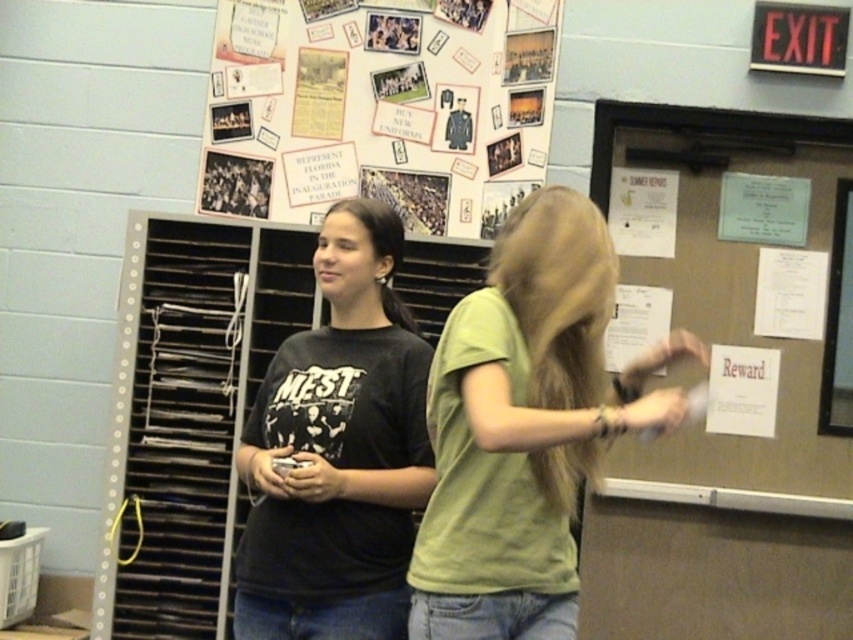
Question: Does multicolored collage at upper center appear on the left side of white paper reward at upper right?

Choices:
 (A) yes
 (B) no

Answer: (A)

Question: Does black matte t-shirt at center have a smaller size compared to white paper poster at upper right?

Choices:
 (A) no
 (B) yes

Answer: (A)

Question: Which point is closer to the camera taking this photo?

Choices:
 (A) (563, 557)
 (B) (421, 436)

Answer: (A)

Question: Which object appears farthest from the camera in this image?

Choices:
 (A) white paper reward at upper right
 (B) matte brown paperboard at right
 (C) multicolored collage at upper center

Answer: (A)

Question: Which object appears farthest from the camera in this image?

Choices:
 (A) white paper poster at upper right
 (B) black matte t-shirt at center

Answer: (A)

Question: Does multicolored collage at upper center appear under green matte shirt at center?

Choices:
 (A) yes
 (B) no

Answer: (B)